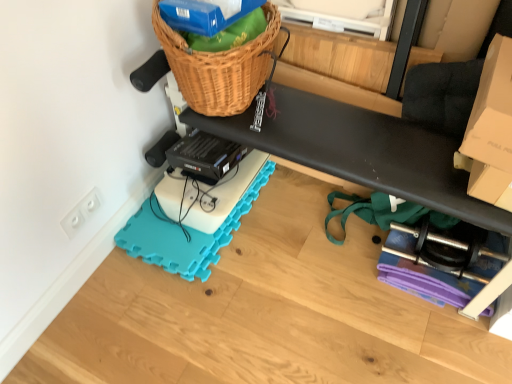
Question: From their relative heights in the image, would you say black rubber exercise mat at lower center is taller or shorter than cardboard box at upper right?

Choices:
 (A) short
 (B) tall

Answer: (A)

Question: Is point (510, 59) closer or farther from the camera than point (480, 79)?

Choices:
 (A) farther
 (B) closer

Answer: (B)

Question: Which of these objects is positioned closest to the cardboard box at upper right?

Choices:
 (A) woven brown basket at upper center
 (B) teal foam yoga mat at lower left
 (C) white plastic electrical outlet at lower left
 (D) black rubber exercise mat at lower center

Answer: (D)

Question: Which of these objects is positioned closest to the white plastic electrical outlet at lower left?

Choices:
 (A) black rubber exercise mat at lower center
 (B) teal foam yoga mat at lower left
 (C) cardboard box at upper right
 (D) woven brown basket at upper center

Answer: (B)